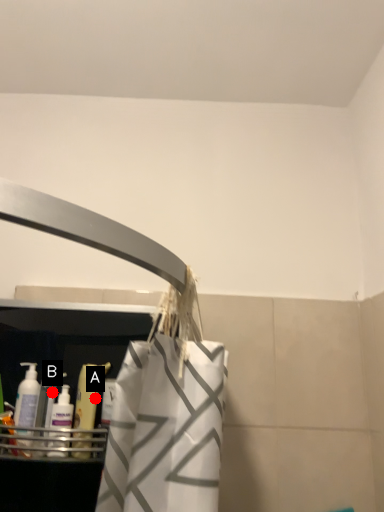
Question: Two points are circled on the image, labeled by A and B beside each circle. Which point appears farthest from the camera in this image?

Choices:
 (A) A is further
 (B) B is further

Answer: (A)